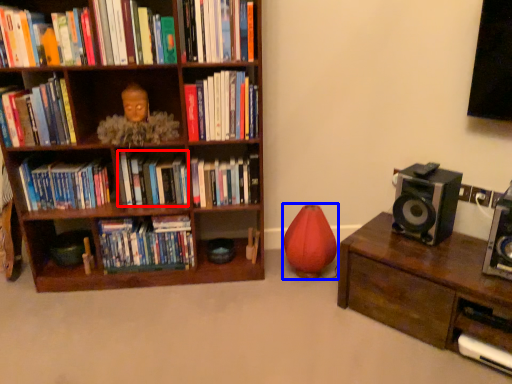
Question: Among these objects, which one is nearest to the camera, book (highlighted by a red box) or toy (highlighted by a blue box)?

Choices:
 (A) book
 (B) toy

Answer: (B)